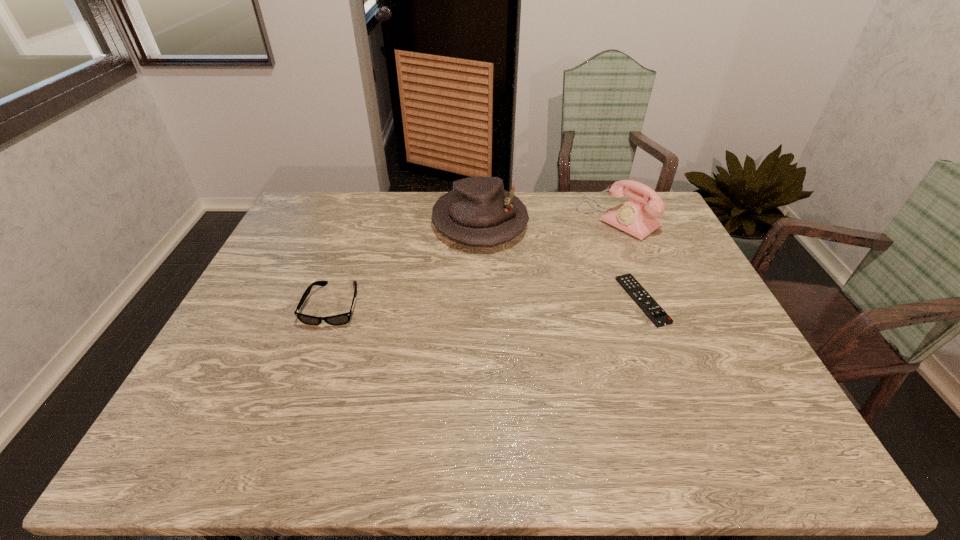
Where is `the second shortest object`? This screenshot has width=960, height=540. the second shortest object is located at coordinates (341, 319).

Where is `sunglasses`? sunglasses is located at coordinates (341, 319).

Image resolution: width=960 pixels, height=540 pixels. Find the location of `remote control`. remote control is located at coordinates (634, 289).

Where is `the second object from left to right`? The image size is (960, 540). the second object from left to right is located at coordinates (478, 211).

Identify the location of telephone. The image size is (960, 540). (633, 217).

Locate an element on the screen. vacant space situated 0.080m on the front-facing side of the leftmost object is located at coordinates (316, 354).

I want to click on vacant space located 0.350m on the back of the shortest object, so click(x=607, y=211).

Where is `vacant region located 0.200m on the decorative side of the hat`? vacant region located 0.200m on the decorative side of the hat is located at coordinates coord(505,298).

I want to click on vacant space situated 0.230m on the decorative side of the hat, so click(508, 306).

In order to click on free space located on the decorative side of the hat in this screenshot , I will do `click(501, 286)`.